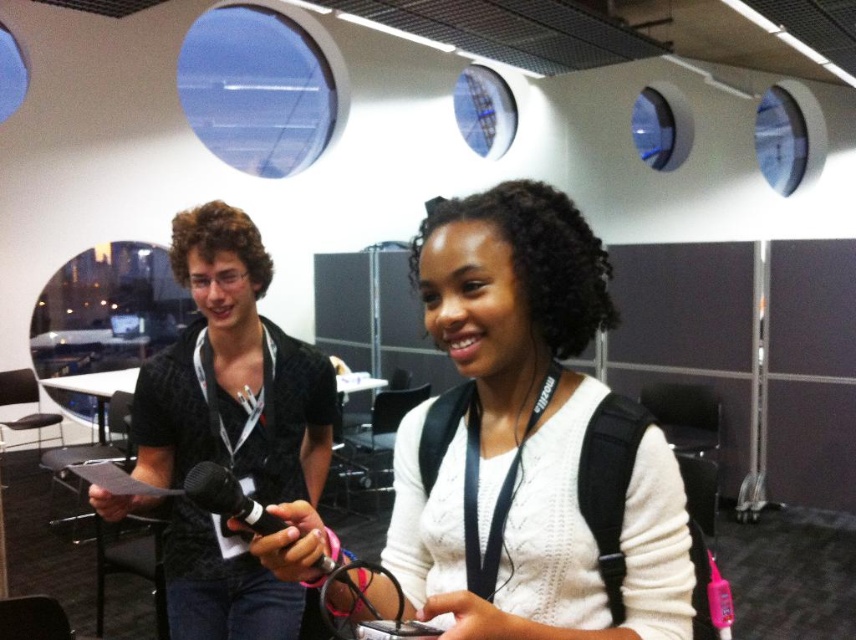
Who is more distant from viewer, (568, 321) or (211, 627)?

Point (211, 627)

Who is positioned more to the right, white knitted sweater at center or black textured shirt at left?

white knitted sweater at center is more to the right.

Is point (667, 504) farther from camera compared to point (290, 588)?

No, it is not.

At what (x,y) coordinates should I click in order to perform the action: click on white knitted sweater at center. Please return your answer as a coordinate pair (x, y). Looking at the image, I should click on (528, 442).